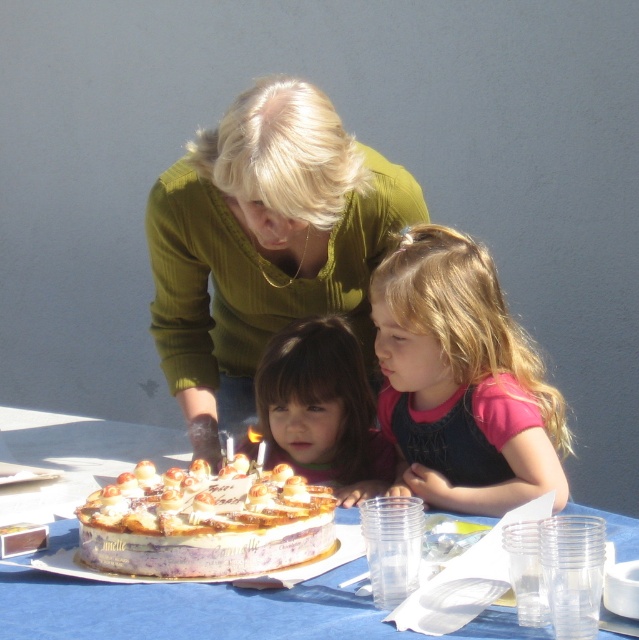
Can you confirm if pink fabric shirt at center is positioned above golden glaze cake at center?

Correct, pink fabric shirt at center is located above golden glaze cake at center.

You are a GUI agent. You are given a task and a screenshot of the screen. Output one action in this format:
    pyautogui.click(x=<x>, y=<y>)
    Task: Click on the pink fabric shirt at center
    This screenshot has height=640, width=639.
    Given the screenshot: What is the action you would take?
    pyautogui.click(x=461, y=380)

In order to click on pink fabric shirt at center in this screenshot , I will do `click(461, 380)`.

Identify the location of white paper plate at center. Image resolution: width=639 pixels, height=640 pixels. (185, 609).

Image resolution: width=639 pixels, height=640 pixels. What do you see at coordinates (185, 609) in the screenshot? I see `white paper plate at center` at bounding box center [185, 609].

Describe the element at coordinates (185, 609) in the screenshot. The width and height of the screenshot is (639, 640). I see `white paper plate at center` at that location.

The width and height of the screenshot is (639, 640). In order to click on white paper plate at center in this screenshot , I will do `click(185, 609)`.

Consider the image. Who is taller, golden glaze cake at center or smooth brown hair at center?

With more height is smooth brown hair at center.

At what (x,y) coordinates should I click in order to perform the action: click on golden glaze cake at center. Please return your answer as a coordinate pair (x, y). The height and width of the screenshot is (640, 639). Looking at the image, I should click on (204, 525).

Where is `golden glaze cake at center`? This screenshot has height=640, width=639. golden glaze cake at center is located at coordinates (204, 525).